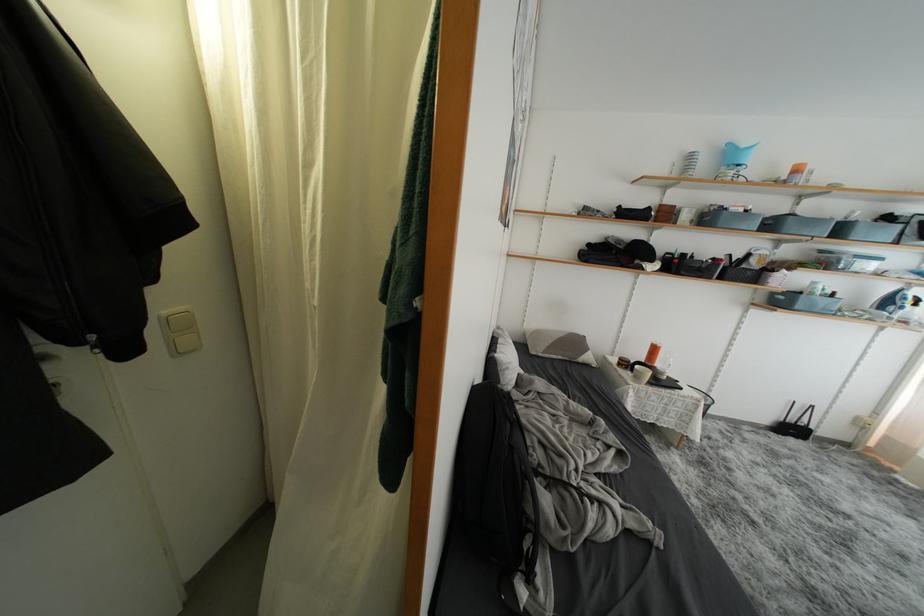
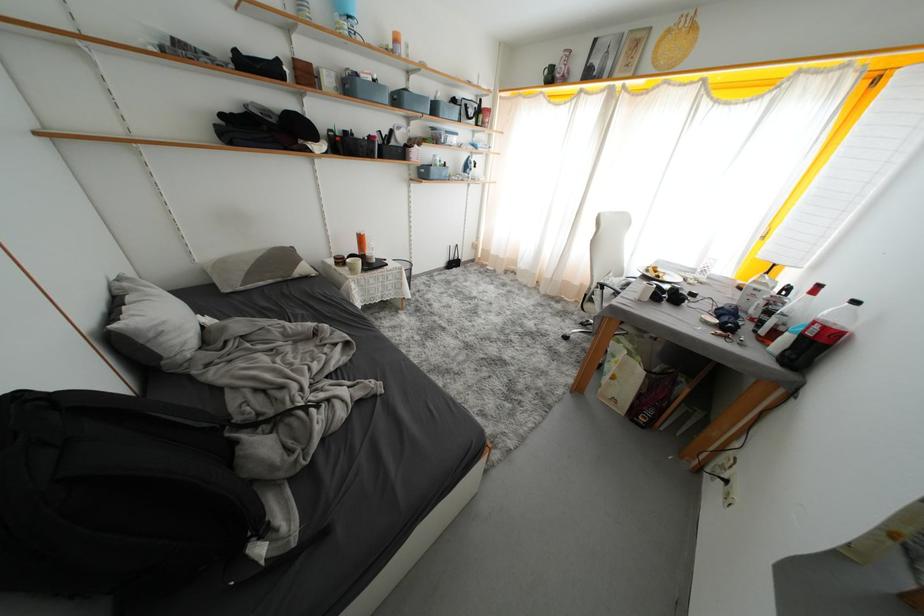
The first image is from the beginning of the video and the second image is from the end. How did the camera likely rotate when shooting the video?

The camera's rotation is toward right-down.